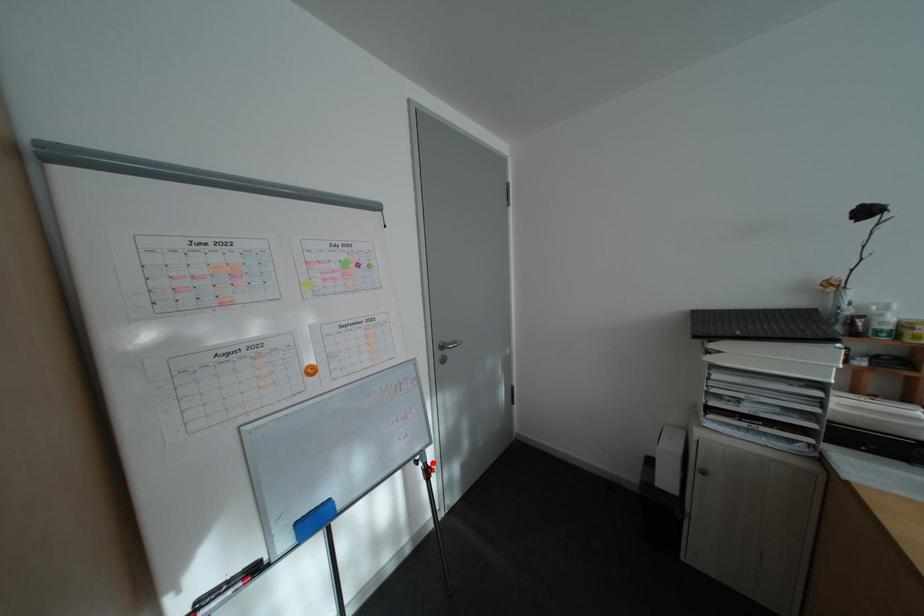
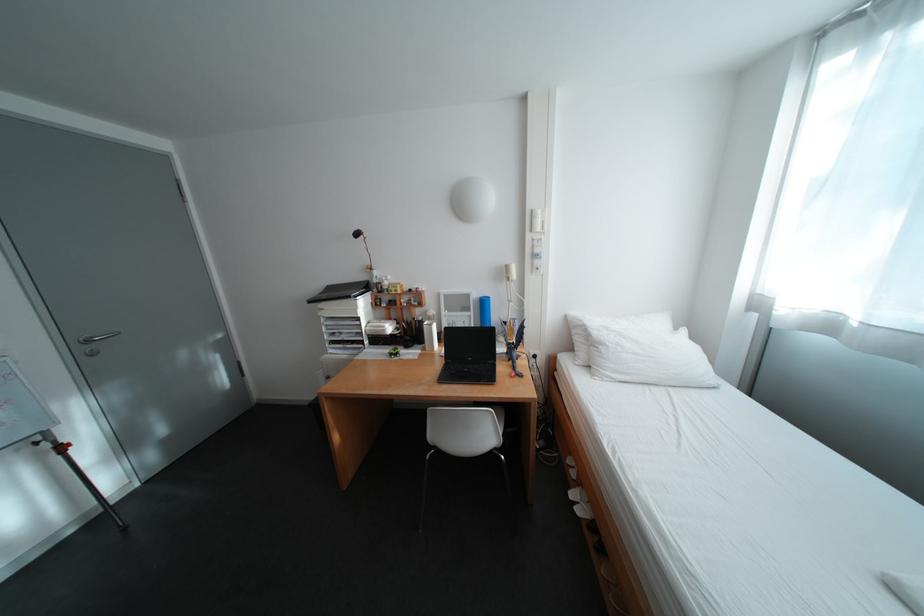
Where in the second image is the point corresponding to the highlighted location from the first image?

(55, 444)